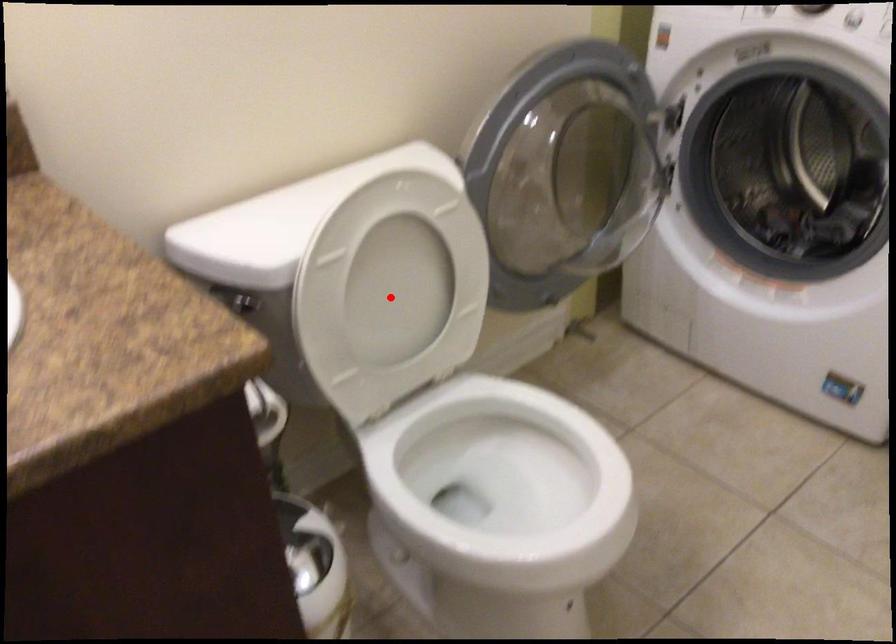
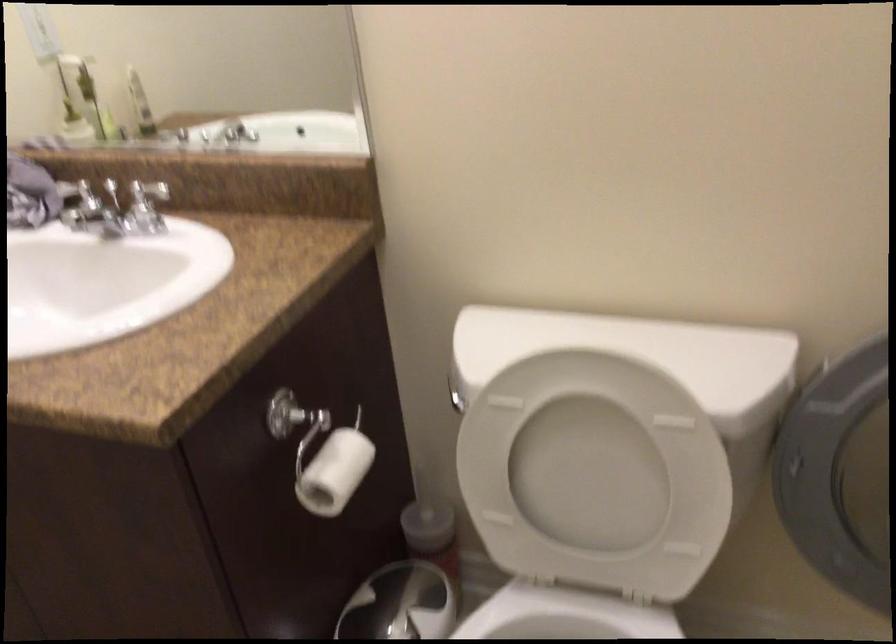
Find the pixel in the second image that matches the highlighted location in the first image.

(595, 475)